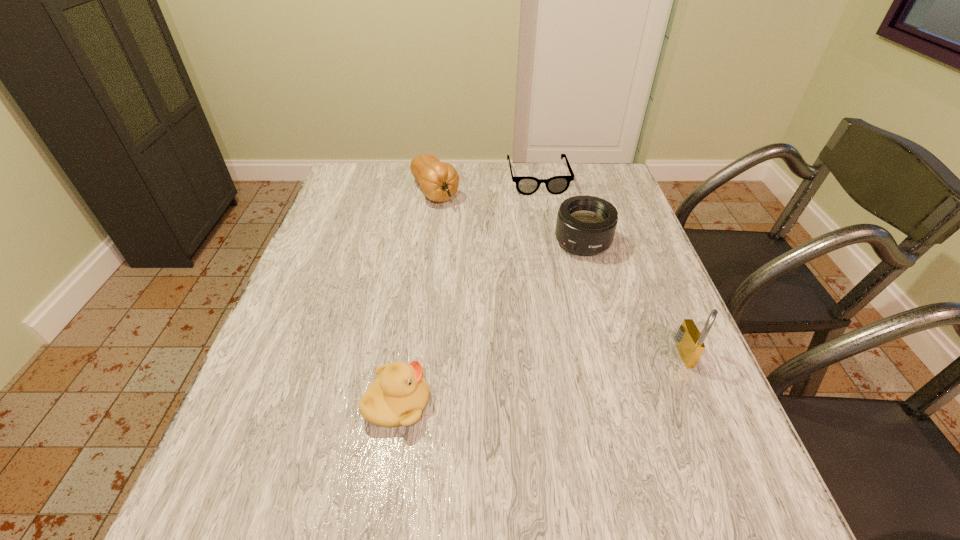
Locate an element on the screen. Image resolution: width=960 pixels, height=540 pixels. telephoto lens positioned at the right edge is located at coordinates (586, 225).

Where is `vacant space at the far edge`? vacant space at the far edge is located at coordinates (466, 192).

This screenshot has width=960, height=540. In the image, there is a desktop. In order to click on free space at the left edge in this screenshot , I will do `click(326, 310)`.

In the image, there is a desktop. In order to click on vacant space at the right edge in this screenshot , I will do `click(639, 389)`.

Find the location of `free space at the far left corner of the desktop`. free space at the far left corner of the desktop is located at coordinates (349, 168).

This screenshot has width=960, height=540. I want to click on vacant space at the near left corner of the desktop, so click(x=292, y=434).

Identify the location of vacant area at the far right corner. This screenshot has width=960, height=540. (585, 162).

Locate an element on the screen. The height and width of the screenshot is (540, 960). vacant space that is in between the gourd and the nearest object is located at coordinates (x=416, y=298).

Find the location of a particular element. Image resolution: width=960 pixels, height=540 pixels. free space between the gourd and the spectacles is located at coordinates (487, 185).

Where is `empty space between the gourd and the padlock`? The image size is (960, 540). empty space between the gourd and the padlock is located at coordinates (562, 273).